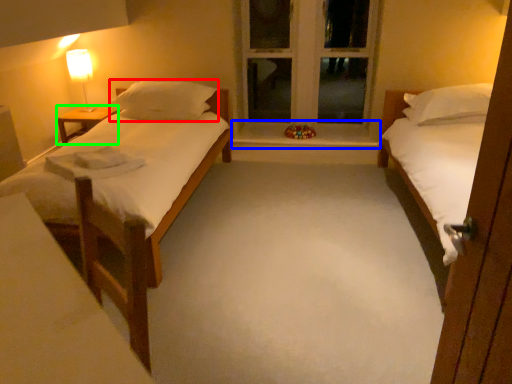
Question: Which object is positioned closest to pillow (highlighted by a red box)? Select from window sill (highlighted by a blue box) and nightstand (highlighted by a green box).

Choices:
 (A) window sill
 (B) nightstand

Answer: (B)